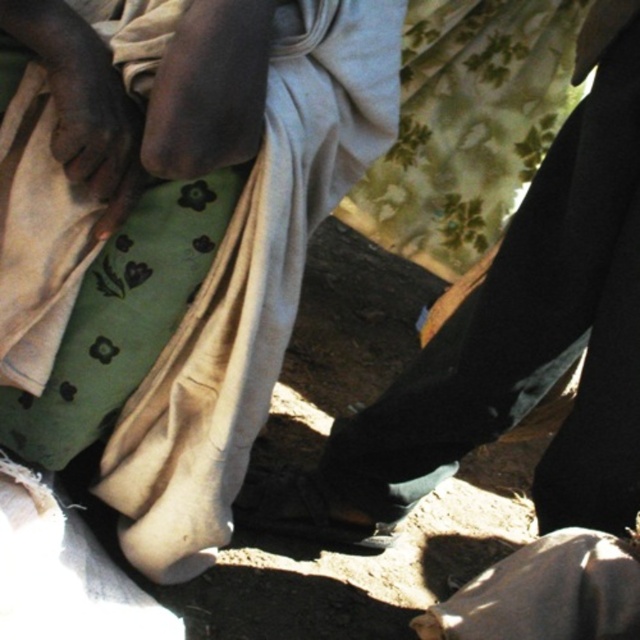
Can you confirm if green fabric at center is positioned above black leather shoe at center?

Yes.

Who is more forward, (205, 401) or (563, 221)?

Point (205, 401) is more forward.

The height and width of the screenshot is (640, 640). Identify the location of green fabric at center. click(252, 289).